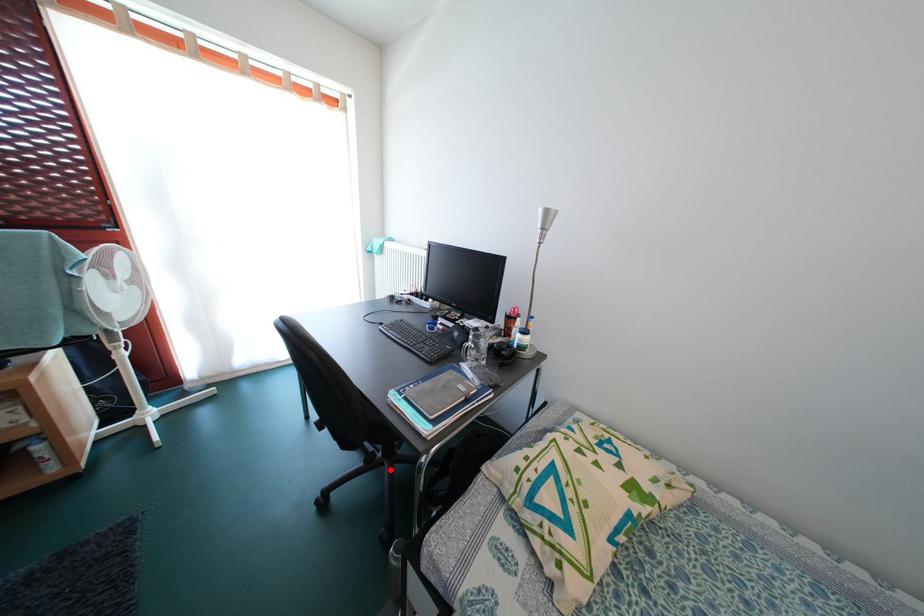
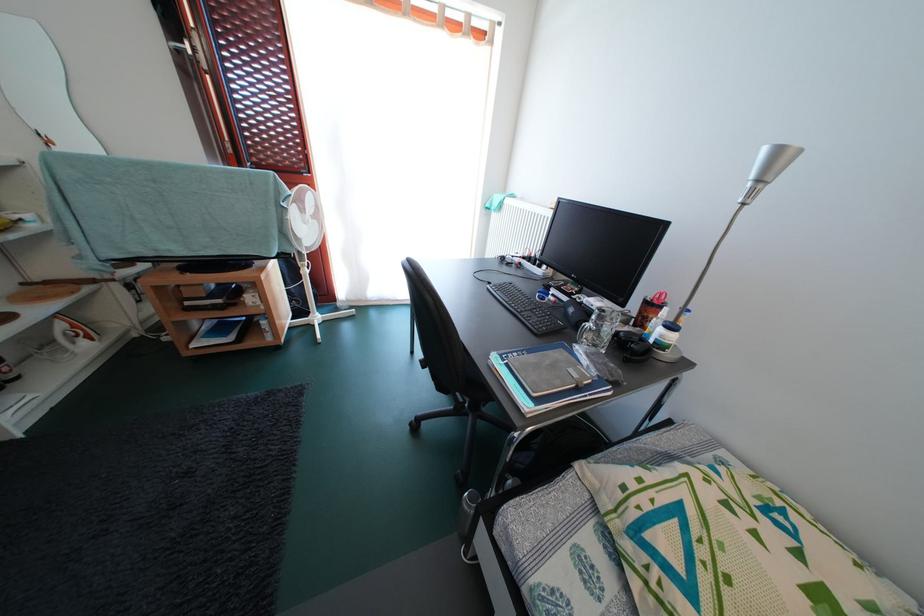
In the second image, find the point that corresponds to the highlighted location in the first image.

(475, 421)